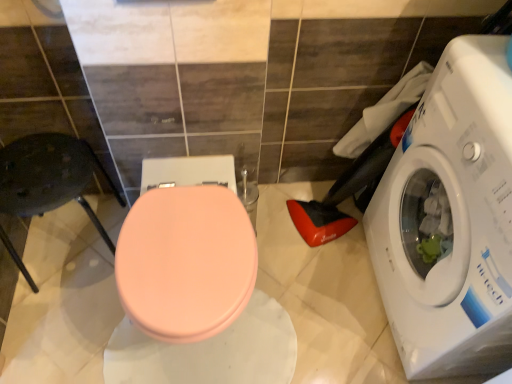
At what (x,y) coordinates should I click in order to perform the action: click on vacant region to the left of matte pink lid at center. Please return your answer as a coordinate pair (x, y). The width and height of the screenshot is (512, 384). Looking at the image, I should click on (55, 315).